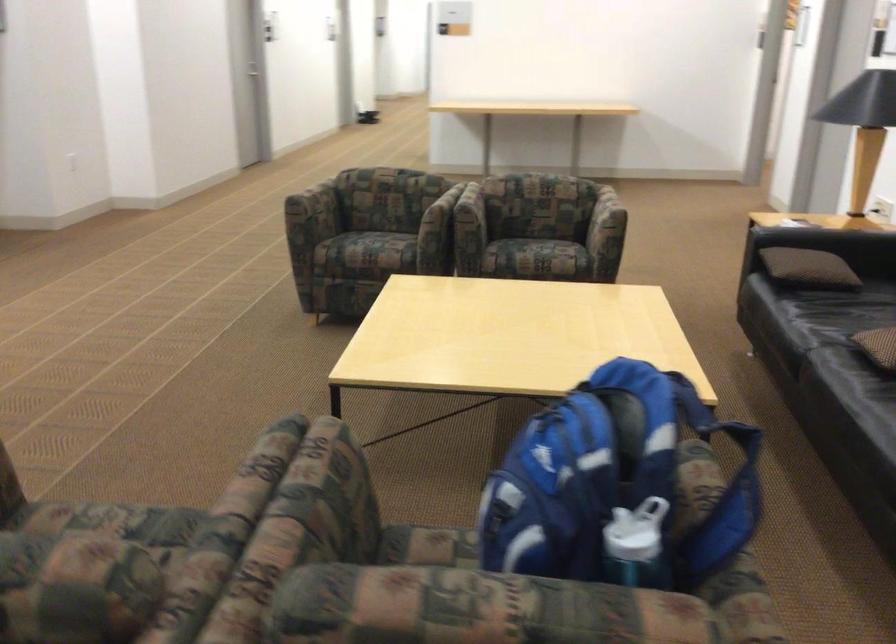
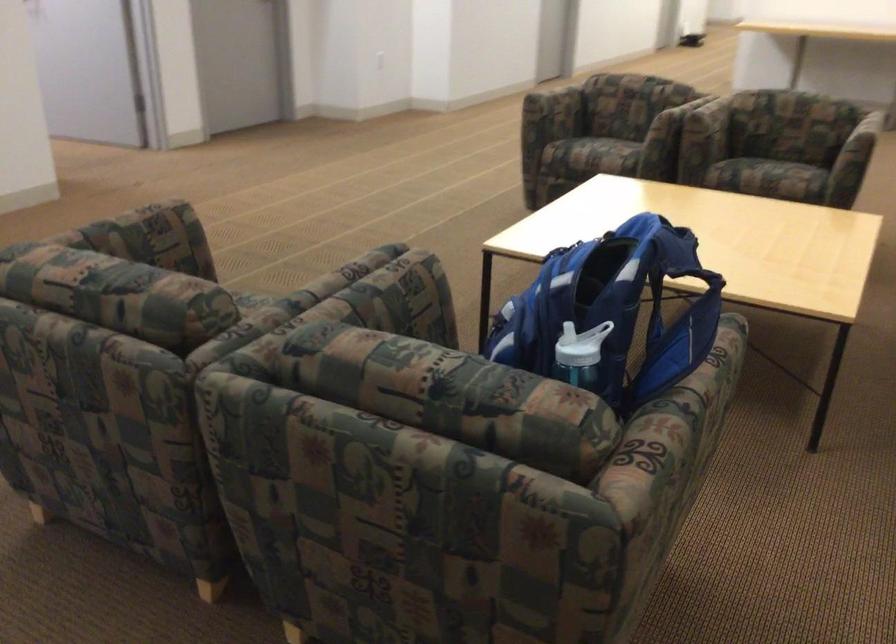
Locate, in the second image, the point that corresponds to point (632, 541) in the first image.

(574, 348)